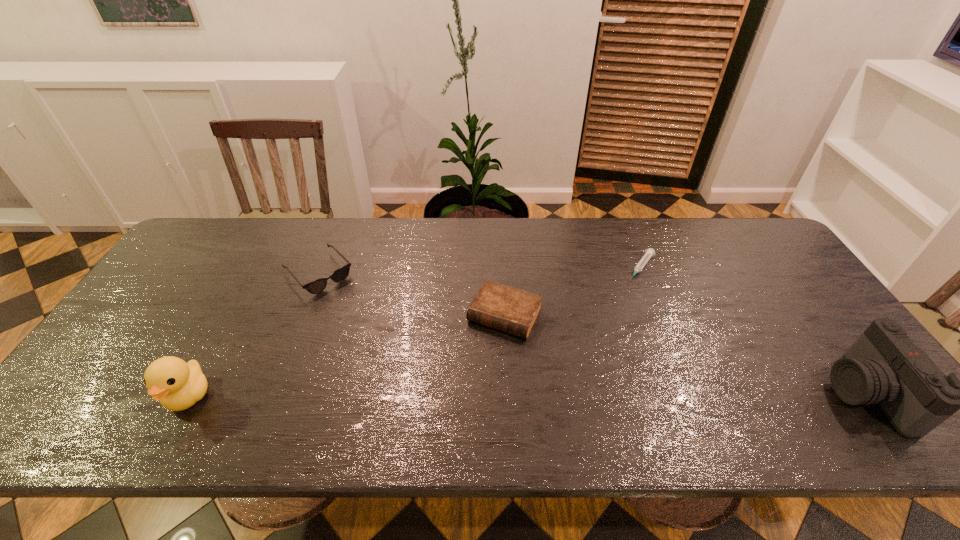
The image size is (960, 540). Find the location of `free space between the syringe and the sunglasses`. free space between the syringe and the sunglasses is located at coordinates (480, 271).

Locate an element on the screen. This screenshot has width=960, height=540. free area in between the duck and the diary is located at coordinates (347, 355).

Image resolution: width=960 pixels, height=540 pixels. In order to click on vacant space that's between the leftmost object and the sunglasses in this screenshot , I will do tap(253, 335).

I want to click on empty space that is in between the duck and the shortest object, so click(415, 332).

Where is `vacant space in between the sunglasses and the shortest object`? vacant space in between the sunglasses and the shortest object is located at coordinates (480, 271).

Find the location of `free space that is in between the sunglasses and the third object from right to left`. free space that is in between the sunglasses and the third object from right to left is located at coordinates (412, 294).

I want to click on free space between the camera and the second object from right to left, so click(753, 330).

The height and width of the screenshot is (540, 960). I want to click on vacant space that's between the sunglasses and the leftmost object, so click(253, 335).

Where is `free space between the second object from left to right and the diary`? The width and height of the screenshot is (960, 540). free space between the second object from left to right and the diary is located at coordinates (412, 294).

Locate an element on the screen. Image resolution: width=960 pixels, height=540 pixels. object that is the closest one to the diary is located at coordinates (650, 252).